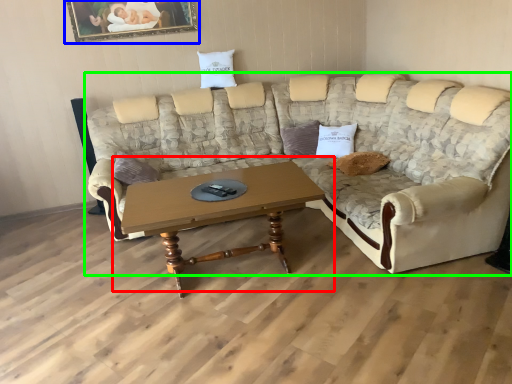
Question: Which is farther away from coffee table (highlighted by a red box)? picture frame (highlighted by a blue box) or studio couch (highlighted by a green box)?

Choices:
 (A) picture frame
 (B) studio couch

Answer: (A)